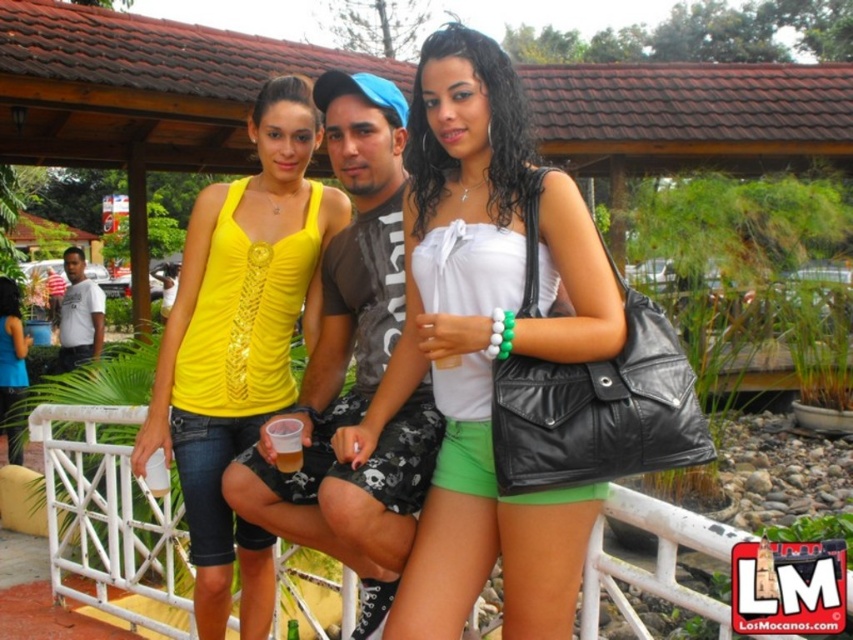
Question: Which object is farther from the camera taking this photo?

Choices:
 (A) white cotton shirt at left
 (B) white matte tank top at center
 (C) matte black t-shirt at center
 (D) yellow matte tank top at center

Answer: (A)

Question: Among these points, which one is nearest to the camera?

Choices:
 (A) (461, 580)
 (B) (93, 285)

Answer: (A)

Question: Which object is closer to the camera taking this photo?

Choices:
 (A) white cotton shirt at left
 (B) white matte tank top at center

Answer: (B)

Question: Is white matte tank top at center smaller than yellow matte tank top at center?

Choices:
 (A) no
 (B) yes

Answer: (B)

Question: Can you confirm if white matte tank top at center is positioned to the right of matte black t-shirt at center?

Choices:
 (A) no
 (B) yes

Answer: (B)

Question: Does yellow matte tank top at center appear over matte black t-shirt at center?

Choices:
 (A) yes
 (B) no

Answer: (B)